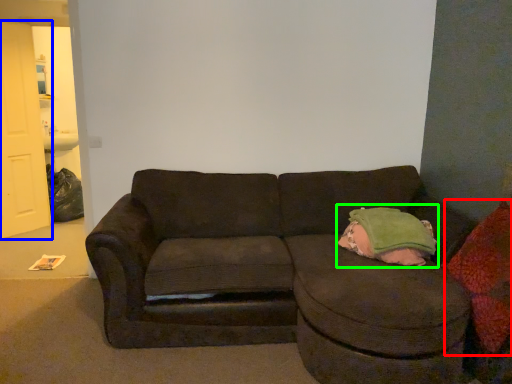
Question: Which is nearer to the throw pillow (highlighted by a red box)? door (highlighted by a blue box) or bean bag chair (highlighted by a green box).

Choices:
 (A) door
 (B) bean bag chair

Answer: (B)